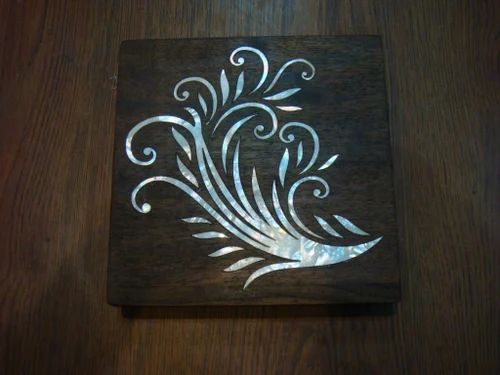
You are a GUI agent. You are given a task and a screenshot of the screen. Output one action in this format:
    pyautogui.click(x=<x>, y=<y>)
    Task: Click on the bottom left corner of plank
    The image size is (500, 375).
    Given the screenshot: What is the action you would take?
    pyautogui.click(x=108, y=302)